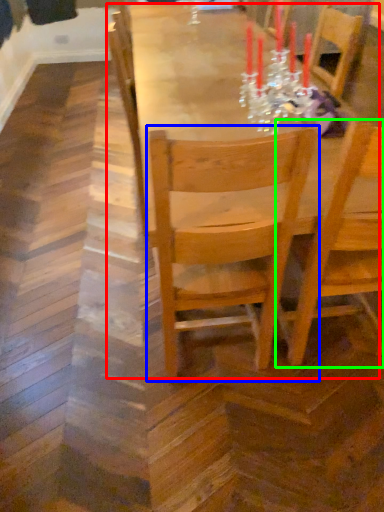
Question: Which is nearer to the table (highlighted by a red box)? chair (highlighted by a blue box) or chair (highlighted by a green box).

Choices:
 (A) chair
 (B) chair

Answer: (A)